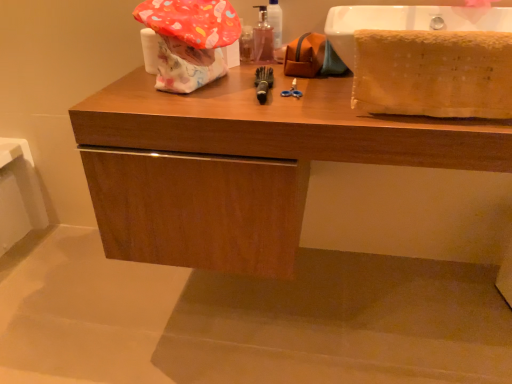
Find the location of a particular element. free point to the left of soft yellow towel at right is located at coordinates (323, 112).